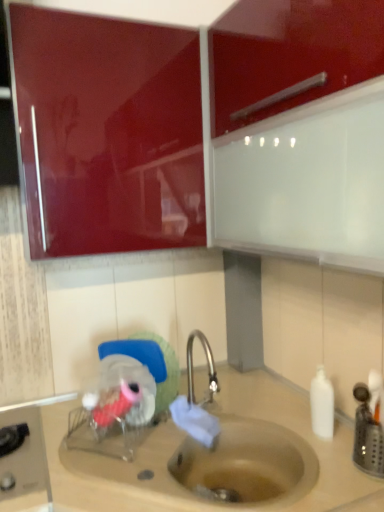
I want to click on white matte bottle at right, so click(x=322, y=405).

Locate an element on the screen. beige matte sink at lower center is located at coordinates 238,453.

Is beige matte sink at lower center not within white matte bottle at right?

That's correct, beige matte sink at lower center is outside of white matte bottle at right.

From the image's perspective, is beige matte sink at lower center located beneath white matte bottle at right?

Yes.

Could you tell me if beige matte sink at lower center is turned towards white matte bottle at right?

No, beige matte sink at lower center is not facing towards white matte bottle at right.

Is beige matte sink at lower center far away from white matte bottle at right?

No, beige matte sink at lower center is not far away from white matte bottle at right.

From the picture: Does white matte bottle at right turn towards beige matte sink at lower center?

No, white matte bottle at right does not turn towards beige matte sink at lower center.

Between white matte bottle at right and beige matte sink at lower center, which one has smaller size?

white matte bottle at right is smaller.

Is white matte bottle at right wider or thinner than beige matte sink at lower center?

Clearly, white matte bottle at right has less width compared to beige matte sink at lower center.

Is point (323, 405) closer to viewer compared to point (191, 375)?

Yes, point (323, 405) is in front of point (191, 375).

Considering the sizes of objects glossy red cabinet at upper left and beige matte sink at lower center in the image provided, who is bigger, glossy red cabinet at upper left or beige matte sink at lower center?

beige matte sink at lower center.

From a real-world perspective, is glossy red cabinet at upper left located beneath beige matte sink at lower center?

Actually, glossy red cabinet at upper left is physically above beige matte sink at lower center in the real world.

In the scene shown: Which object is wider, glossy red cabinet at upper left or beige matte sink at lower center?

beige matte sink at lower center.

Is glossy red cabinet at upper left far from beige matte sink at lower center?

glossy red cabinet at upper left is actually quite close to beige matte sink at lower center.

Can you confirm if white matte bottle at right is shorter than glossy red cabinet at upper left?

Yes.

Is white matte bottle at right outside of glossy red cabinet at upper left?

Indeed, white matte bottle at right is completely outside glossy red cabinet at upper left.

Which is nearer, (323, 401) or (124, 170)?

Positioned in front is point (323, 401).

How many degrees apart are the facing directions of white matte bottle at right and glossy red cabinet at upper left?

46 degrees separate the facing orientations of white matte bottle at right and glossy red cabinet at upper left.

Could you tell me if beige matte sink at lower center is facing glossy red cabinet at upper left?

No, beige matte sink at lower center is not oriented towards glossy red cabinet at upper left.

How different are the orientations of beige matte sink at lower center and glossy red cabinet at upper left in degrees?

There is a 90.8-degree angle between the facing directions of beige matte sink at lower center and glossy red cabinet at upper left.

Based on the photo, from a real-world perspective, which is physically below, beige matte sink at lower center or glossy red cabinet at upper left?

beige matte sink at lower center, from a real-world perspective.

Is the depth of beige matte sink at lower center greater than that of glossy red cabinet at upper left?

No, it is not.

Which is correct: glossy red cabinet at upper left is inside white matte bottle at right, or outside of it?

glossy red cabinet at upper left is located beyond the bounds of white matte bottle at right.

Does glossy red cabinet at upper left turn towards white matte bottle at right?

No, glossy red cabinet at upper left is not oriented towards white matte bottle at right.

Can you confirm if glossy red cabinet at upper left is positioned to the right of white matte bottle at right?

No, glossy red cabinet at upper left is not to the right of white matte bottle at right.

Can you confirm if glossy red cabinet at upper left is taller than white matte bottle at right?

Correct, glossy red cabinet at upper left is much taller as white matte bottle at right.

At what (x,y) coordinates should I click in order to perform the action: click on bottle on the right side of beige matte sink at lower center. Please return your answer as a coordinate pair (x, y). The image size is (384, 512). Looking at the image, I should click on (322, 405).

Where is `sink that appears on the left of white matte bottle at right`? This screenshot has width=384, height=512. sink that appears on the left of white matte bottle at right is located at coordinates (x=238, y=453).

Estimate the real-world distances between objects in this image. Which object is closer to glossy red cabinet at upper left, beige matte sink at lower center or white matte bottle at right?

The object closer to glossy red cabinet at upper left is beige matte sink at lower center.

In the scene shown: Based on their spatial positions, is glossy red cabinet at upper left or white matte bottle at right closer to beige matte sink at lower center?

white matte bottle at right is closer to beige matte sink at lower center.

Based on their spatial positions, is white matte bottle at right or glossy red cabinet at upper left closer to beige matte sink at lower center?

Based on the image, white matte bottle at right appears to be nearer to beige matte sink at lower center.

Considering their positions, is beige matte sink at lower center positioned further to white matte bottle at right than glossy red cabinet at upper left?

The object further to white matte bottle at right is glossy red cabinet at upper left.

Based on their spatial positions, is white matte bottle at right or beige matte sink at lower center closer to glossy red cabinet at upper left?

The object closer to glossy red cabinet at upper left is beige matte sink at lower center.

Estimate the real-world distances between objects in this image. Which object is closer to white matte bottle at right, glossy red cabinet at upper left or beige matte sink at lower center?

beige matte sink at lower center.

Where is `bottle between glossy red cabinet at upper left and beige matte sink at lower center in the up-down direction`? This screenshot has height=512, width=384. bottle between glossy red cabinet at upper left and beige matte sink at lower center in the up-down direction is located at coordinates (322, 405).